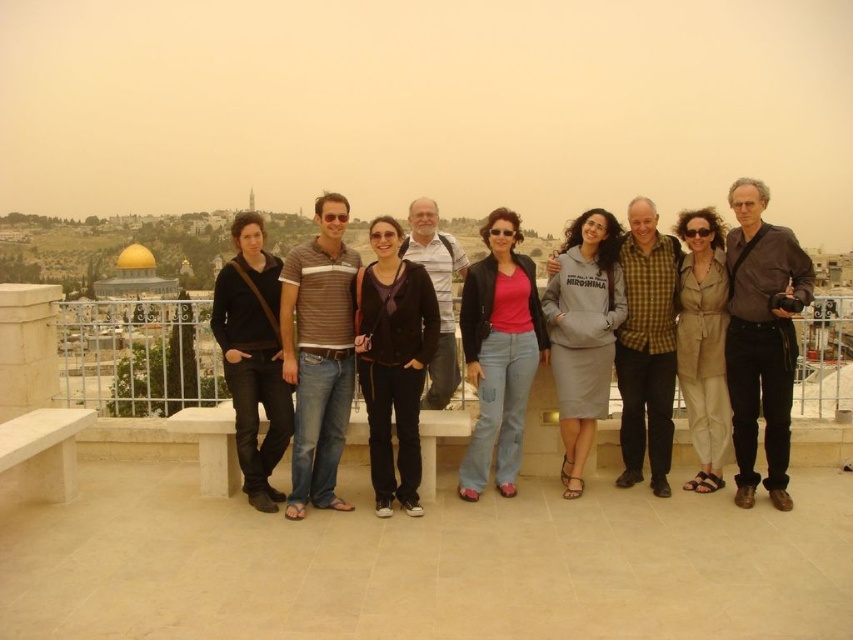
Looking at this image, between pink matte shirt at center and beige fabric dress at center-right, which one has less height?

beige fabric dress at center-right is shorter.

The height and width of the screenshot is (640, 853). I want to click on pink matte shirt at center, so click(498, 353).

Where is `pink matte shirt at center`? This screenshot has height=640, width=853. pink matte shirt at center is located at coordinates (498, 353).

Which of these two, gray cotton sweatshirt at center or beige fabric dress at center-right, stands shorter?

With less height is beige fabric dress at center-right.

Is gray cotton sweatshirt at center thinner than beige fabric dress at center-right?

Incorrect, gray cotton sweatshirt at center's width is not less than beige fabric dress at center-right's.

Between point (575, 220) and point (717, 221), which one is positioned behind?

Point (575, 220)

Locate an element on the screen. gray cotton sweatshirt at center is located at coordinates (583, 333).

Who is positioned more to the right, matte black jacket at center or pink matte shirt at center?

pink matte shirt at center

Does matte black jacket at center appear over pink matte shirt at center?

Actually, matte black jacket at center is below pink matte shirt at center.

The height and width of the screenshot is (640, 853). What do you see at coordinates (393, 362) in the screenshot?
I see `matte black jacket at center` at bounding box center [393, 362].

Identify the location of matte black jacket at center. (393, 362).